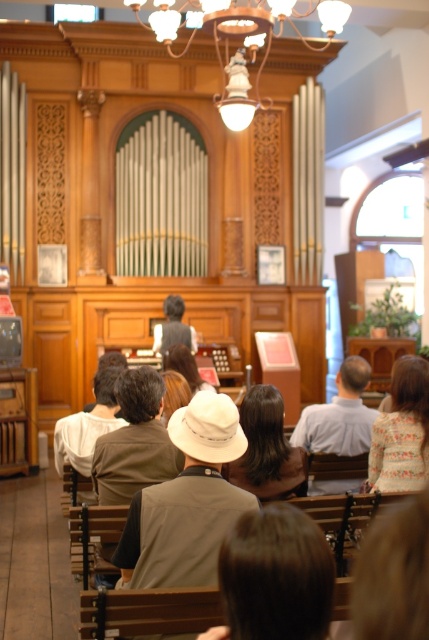
Question: Among these objects, which one is nearest to the camera?

Choices:
 (A) light brown leather jacket at center
 (B) matte brass chandelier at upper center

Answer: (B)

Question: Is matte brass chandelier at upper center smaller than light brown leather jacket at center?

Choices:
 (A) yes
 (B) no

Answer: (B)

Question: Which of the following is the closest to the observer?

Choices:
 (A) light brown leather jacket at center
 (B) matte brass chandelier at upper center

Answer: (B)

Question: Which point is farther from the camera taking this photo?

Choices:
 (A) click(233, 38)
 (B) click(186, 332)

Answer: (B)

Question: Is matte brass chandelier at upper center closer to the viewer compared to light brown leather jacket at center?

Choices:
 (A) no
 (B) yes

Answer: (B)

Question: Is matte brass chandelier at upper center positioned behind light brown leather jacket at center?

Choices:
 (A) yes
 (B) no

Answer: (B)